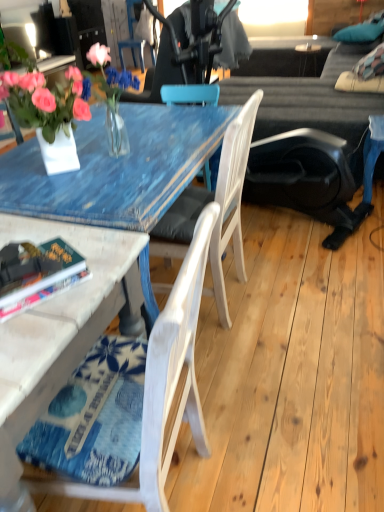
Question: Is teal fabric pillow at upper right a part of white wood chair at lower left, which is counted as the 1th chair, starting from the front?

Choices:
 (A) yes
 (B) no

Answer: (B)

Question: Is white wood chair at lower left, placed as the third chair when sorted from back to front, looking in the opposite direction of teal fabric pillow at upper right?

Choices:
 (A) yes
 (B) no

Answer: (B)

Question: Can you confirm if white wood chair at lower left, which ranks as the third chair in top-to-bottom order, is thinner than teal fabric pillow at upper right?

Choices:
 (A) no
 (B) yes

Answer: (B)

Question: From the image's perspective, is white wood chair at lower left, which ranks as the third chair in top-to-bottom order, over teal fabric pillow at upper right?

Choices:
 (A) yes
 (B) no

Answer: (B)

Question: Is white wood chair at lower left, the 1th chair when ordered from bottom to top, positioned behind teal fabric pillow at upper right?

Choices:
 (A) yes
 (B) no

Answer: (B)

Question: Considering the relative sizes of white wood chair at lower left, which is counted as the 1th chair, starting from the front, and teal fabric pillow at upper right in the image provided, is white wood chair at lower left, which is counted as the 1th chair, starting from the front, shorter than teal fabric pillow at upper right?

Choices:
 (A) yes
 (B) no

Answer: (B)

Question: Considering the relative sizes of wooden chair at upper center, which is the 3th chair from bottom to top, and white wood chair at center, which is counted as the 2th chair, starting from the back, in the image provided, is wooden chair at upper center, which is the 3th chair from bottom to top, smaller than white wood chair at center, which is counted as the 2th chair, starting from the back,?

Choices:
 (A) no
 (B) yes

Answer: (B)

Question: Is wooden chair at upper center, which ranks as the 1th chair in top-to-bottom order, shorter than white wood chair at center, which is the 2th chair from front to back?

Choices:
 (A) no
 (B) yes

Answer: (A)

Question: Is white wood chair at center, which is the 2th chair from bottom to top, inside wooden chair at upper center, which ranks as the 1th chair in top-to-bottom order?

Choices:
 (A) yes
 (B) no

Answer: (B)

Question: Considering the relative sizes of wooden chair at upper center, placed as the third chair when sorted from front to back, and white wood chair at center, which is the 2th chair from front to back, in the image provided, is wooden chair at upper center, placed as the third chair when sorted from front to back, thinner than white wood chair at center, which is the 2th chair from front to back,?

Choices:
 (A) no
 (B) yes

Answer: (B)

Question: From the image's perspective, is wooden chair at upper center, placed as the third chair when sorted from front to back, above white wood chair at center, which is the 2th chair from bottom to top?

Choices:
 (A) yes
 (B) no

Answer: (A)

Question: Considering the relative positions of wooden chair at upper center, the first chair viewed from the back, and white wood chair at center, which is the 2th chair from front to back, in the image provided, is wooden chair at upper center, the first chair viewed from the back, behind white wood chair at center, which is the 2th chair from front to back,?

Choices:
 (A) yes
 (B) no

Answer: (A)

Question: Is hardcover book at lower left facing away from dark gray fabric couch at upper right?

Choices:
 (A) yes
 (B) no

Answer: (A)